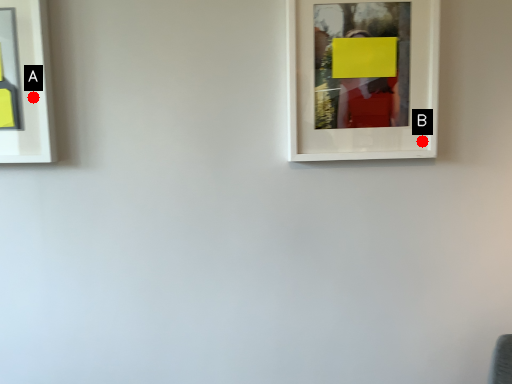
Question: Two points are circled on the image, labeled by A and B beside each circle. Which point is closer to the camera?

Choices:
 (A) A is closer
 (B) B is closer

Answer: (A)